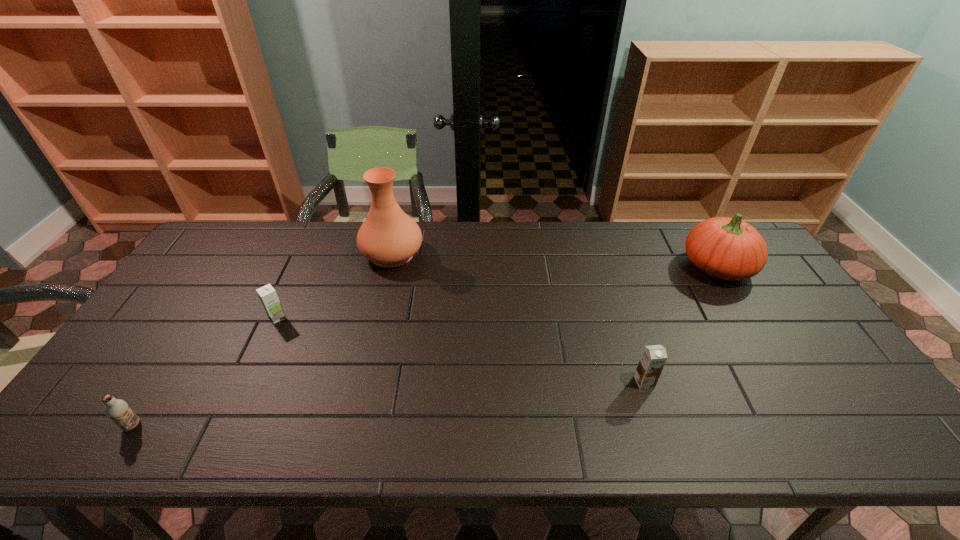
Where is `vase`? The image size is (960, 540). vase is located at coordinates (388, 237).

At what (x,y) coordinates should I click in order to perform the action: click on the third object from left to right. Please return your answer as a coordinate pair (x, y). This screenshot has width=960, height=540. Looking at the image, I should click on (388, 237).

At what (x,y) coordinates should I click in order to perform the action: click on the rightmost object. Please return your answer as a coordinate pair (x, y). Looking at the image, I should click on (727, 248).

Image resolution: width=960 pixels, height=540 pixels. Find the location of `the second tallest object`. the second tallest object is located at coordinates (727, 248).

You are a GUI agent. You are given a task and a screenshot of the screen. Output one action in this format:
    pyautogui.click(x=<x>, y=<y>)
    Task: Click on the second nearest object
    Image resolution: width=960 pixels, height=540 pixels.
    Given the screenshot: What is the action you would take?
    pyautogui.click(x=653, y=358)

Locate an element on the screen. Image resolution: width=960 pixels, height=540 pixels. the fourth object from left to right is located at coordinates (653, 358).

This screenshot has width=960, height=540. Identify the location of the farthest chocolate milk. (268, 296).

Where is `the second chocolate milk from right to left`? The height and width of the screenshot is (540, 960). the second chocolate milk from right to left is located at coordinates (268, 296).

Identify the location of the leftmost chocolate milk. (117, 410).

Find the location of a particular element. the nearest object is located at coordinates (117, 410).